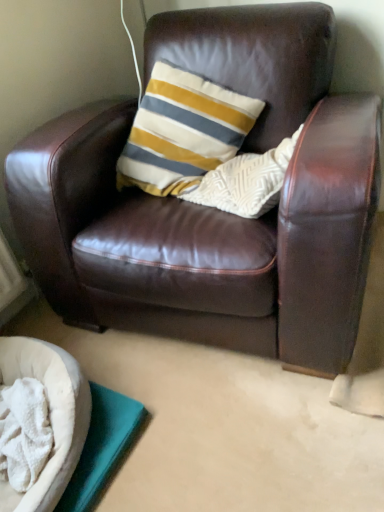
This screenshot has width=384, height=512. Find the location of `vacant space to the right of white soft dog bed at lower left`. vacant space to the right of white soft dog bed at lower left is located at coordinates (179, 410).